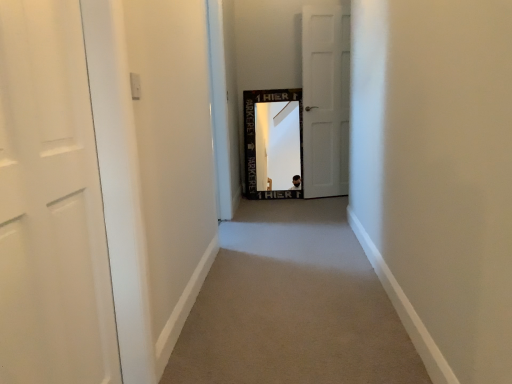
Question: Considering the relative positions of carpet at center and white matte door at left, which appears as the second door when viewed from the right, in the image provided, is carpet at center to the left or to the right of white matte door at left, which appears as the second door when viewed from the right,?

Choices:
 (A) left
 (B) right

Answer: (B)

Question: Is carpet at center inside the boundaries of white matte door at left, marked as the 1th door in a front-to-back arrangement, or outside?

Choices:
 (A) outside
 (B) inside

Answer: (A)

Question: Based on their relative distances, which object is nearer to the white matte door at center, the 1th door from the back?

Choices:
 (A) white matte door at left, marked as the 1th door in a front-to-back arrangement
 (B) carpet at center

Answer: (B)

Question: Estimate the real-world distances between objects in this image. Which object is closer to the white matte door at left, positioned as the 2th door in back-to-front order?

Choices:
 (A) carpet at center
 (B) white matte door at center, the 1th door from the back

Answer: (A)